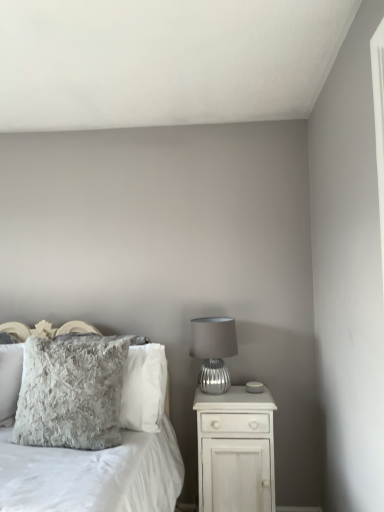
Question: Choose the correct answer: Is white wood nightstand at right inside fuzzy gray pillow at left, the 2th pillow positioned from the back, or outside it?

Choices:
 (A) inside
 (B) outside

Answer: (B)

Question: From a real-world perspective, is white wood nightstand at right physically located above or below fuzzy gray pillow at left, the 2th pillow positioned from the back?

Choices:
 (A) above
 (B) below

Answer: (B)

Question: Estimate the real-world distances between objects in this image. Which object is farther from the silver textured lamp at right?

Choices:
 (A) fuzzy gray pillow at center
 (B) fuzzy gray pillow at left, which is counted as the 1th pillow, starting from the front
 (C) white wood nightstand at right
 (D) fuzzy gray pillow at center-left, the first pillow from the back

Answer: (B)

Question: Considering the real-world distances, which object is closest to the white wood nightstand at right?

Choices:
 (A) fuzzy gray pillow at left, the 2th pillow positioned from the back
 (B) fuzzy gray pillow at center-left, positioned as the 2th pillow in front-to-back order
 (C) silver textured lamp at right
 (D) fuzzy gray pillow at center

Answer: (C)